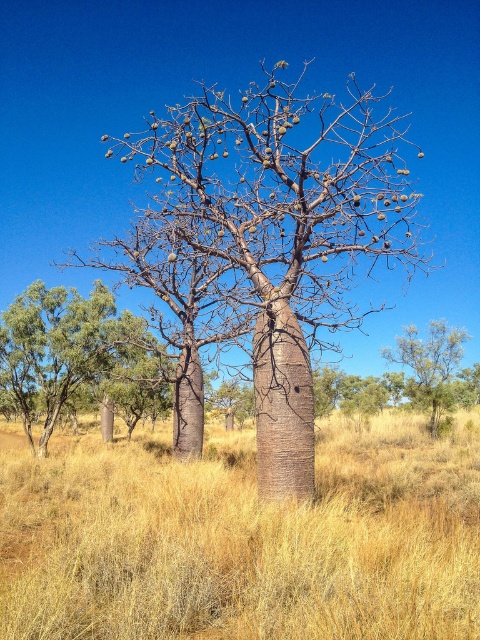
Is smooth brown tree trunk at center closer to the viewer compared to green leafy shrub at upper center?

Yes, smooth brown tree trunk at center is in front of green leafy shrub at upper center.

Is smooth brown tree trunk at center to the right of green leafy shrub at upper center from the viewer's perspective?

No, smooth brown tree trunk at center is not to the right of green leafy shrub at upper center.

Which is in front, point (127, 272) or point (444, 339)?

Point (127, 272) is more forward.

Identify the location of smooth brown tree trunk at center. The image size is (480, 640). (263, 244).

Can you confirm if dry grass at center is positioned below smooth brown tree trunk at center?

Correct, dry grass at center is located below smooth brown tree trunk at center.

Find the location of a particular element. dry grass at center is located at coordinates [244, 538].

Who is shorter, green rough bark tree at lower left or green leafy shrub at upper center?

Standing shorter between the two is green rough bark tree at lower left.

Is green rough bark tree at lower left in front of green leafy shrub at upper center?

Yes, green rough bark tree at lower left is in front of green leafy shrub at upper center.

Between point (27, 436) and point (406, 352), which one is positioned behind?

Positioned behind is point (406, 352).

Locate an element on the screen. This screenshot has height=640, width=480. green rough bark tree at lower left is located at coordinates (61, 348).